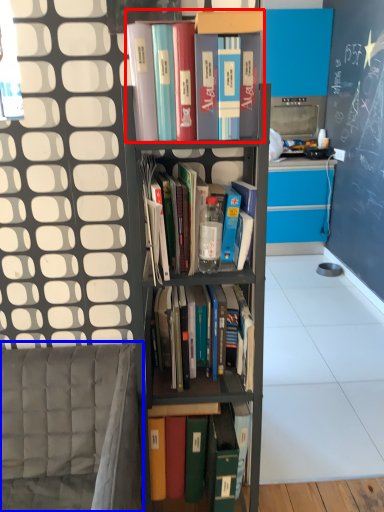
Question: Which of the following is the closest to the observer, book (highlighted by a red box) or armchair (highlighted by a blue box)?

Choices:
 (A) book
 (B) armchair

Answer: (B)